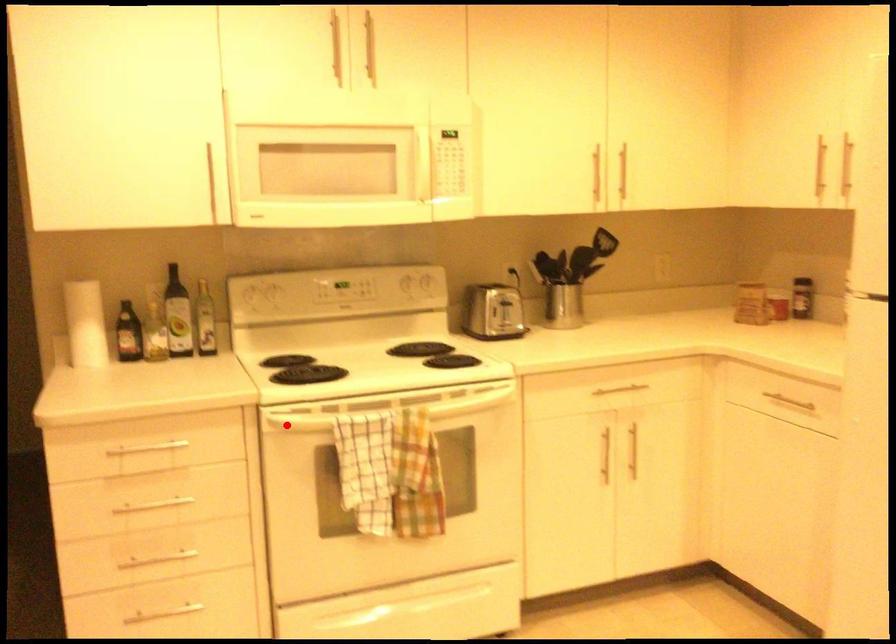
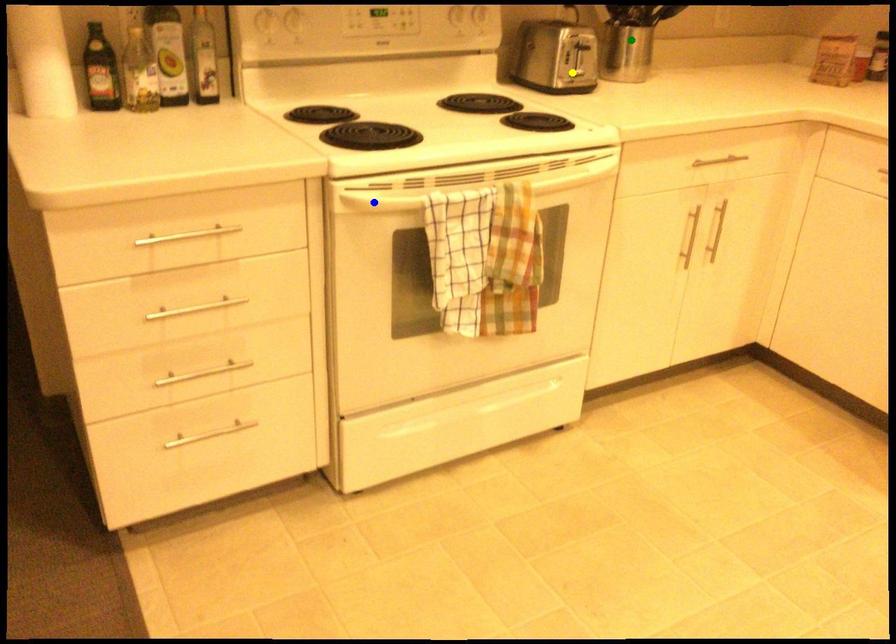
Question: I am providing you with two images of the same scene from different viewpoints. A red point is marked on the first image. You are given multiple points on the second image. In image 2, which mark is for the same physical point as the one in image 1?

Choices:
 (A) blue point
 (B) yellow point
 (C) green point

Answer: (A)